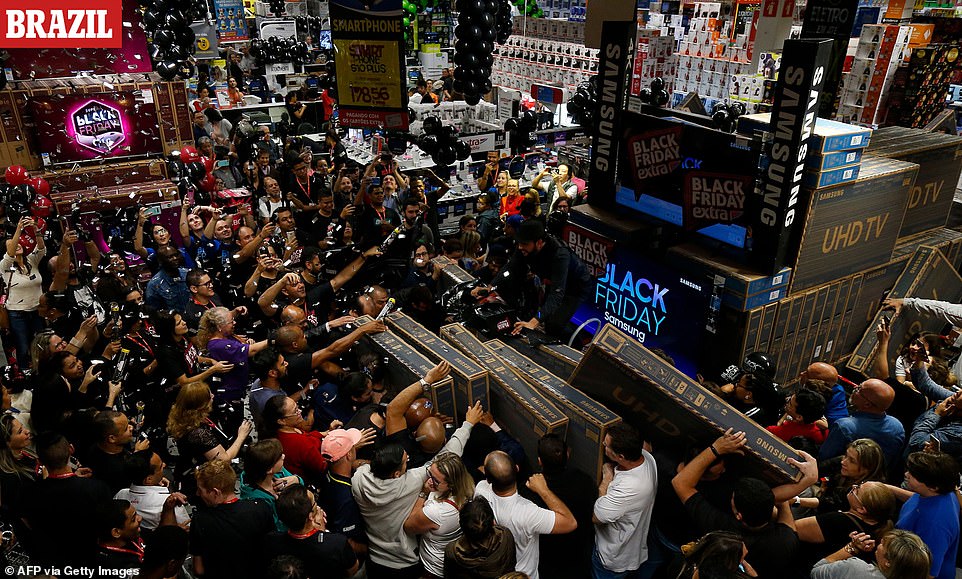
You are a GUI agent. You are given a task and a screenshot of the screen. Output one action in this format:
    pyautogui.click(x=<x>, y=<y>)
    Task: Click on the on television
    
    Given the screenshot: What is the action you would take?
    pyautogui.click(x=628, y=299), pyautogui.click(x=706, y=146), pyautogui.click(x=91, y=126)